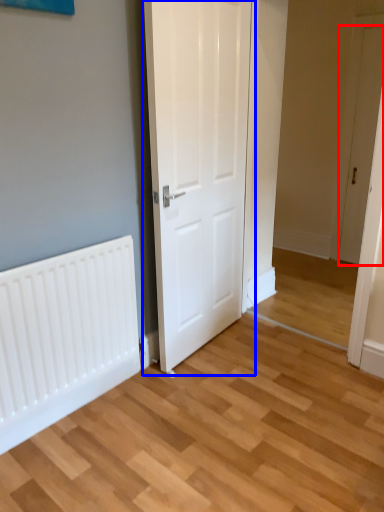
Question: Among these objects, which one is farthest to the camera, door (highlighted by a red box) or door (highlighted by a blue box)?

Choices:
 (A) door
 (B) door

Answer: (A)